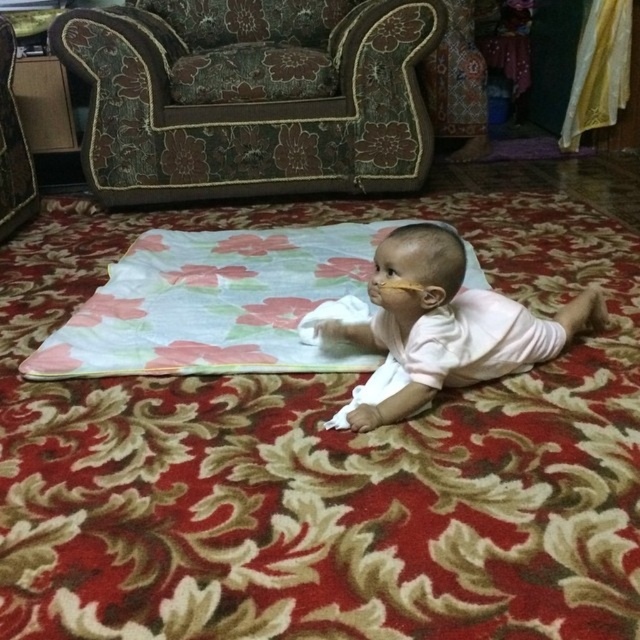
You are a parent trying to place a toy for your baby to reach. The toy needs to be placed between the floral fabric blanket at center and the pink smooth baby at center. What is the minimum distance you should keep between the two objects to ensure the toy fits comfortably?

The minimum distance between the floral fabric blanket at center and the pink smooth baby at center is 16.24 inches. To ensure the toy fits comfortably, you should place it within this space, keeping at least that distance between them.

You are a parent watching your baby on the carpet. The baby is trying to reach the white cloth on the floral fabric blanket at center. Since the pink smooth baby at center is underneath the blanket, can the baby see the white cloth easily?

The floral fabric blanket at center is located above the pink smooth baby at center, so the baby can see the white cloth on the blanket as it is positioned above them.

You are a parent trying to place a toy for your baby who is currently on the pink smooth baby at center. You want to put the toy so that it is exactly at the point with coordinates (448, 323). Where should you place the toy relative to the baby?

The point with coordinates (448, 323) is on the pink smooth baby at center, so you should place the toy directly on the baby.